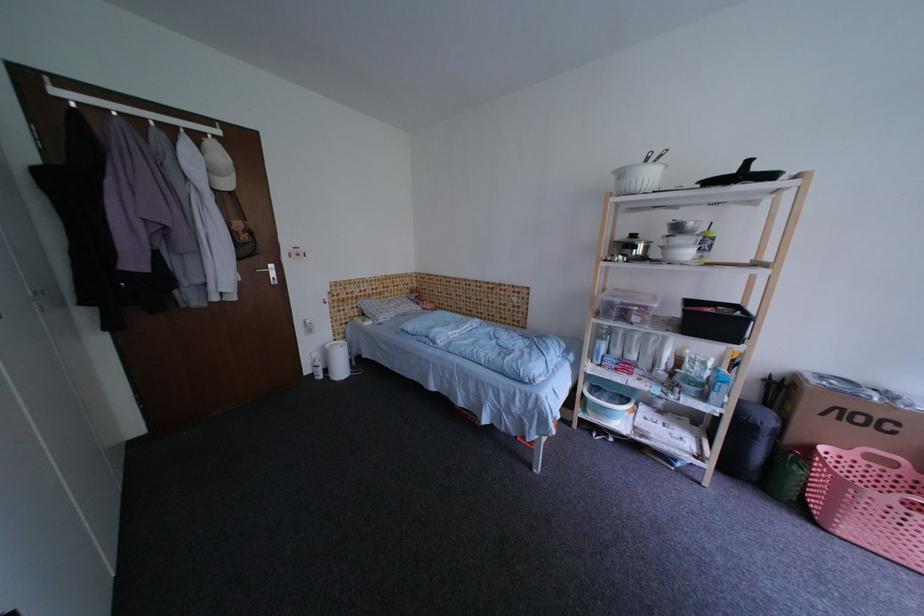
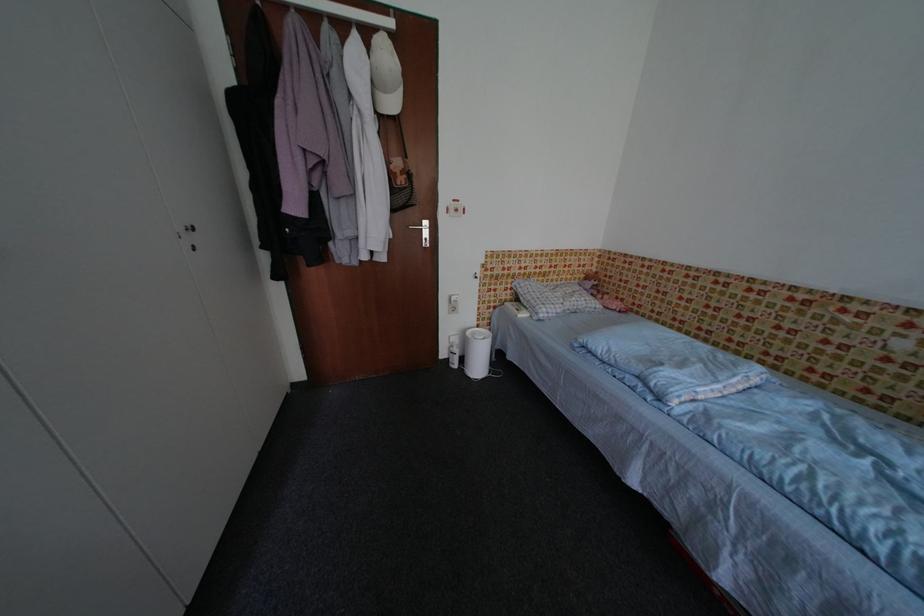
Locate, in the second image, the point that corresponds to (x=236, y=187) in the first image.

(400, 107)